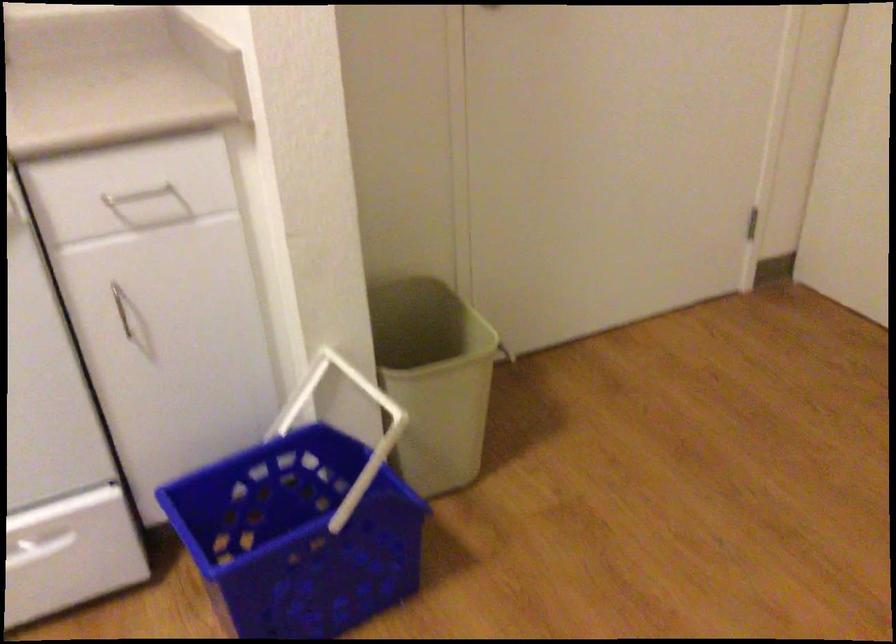
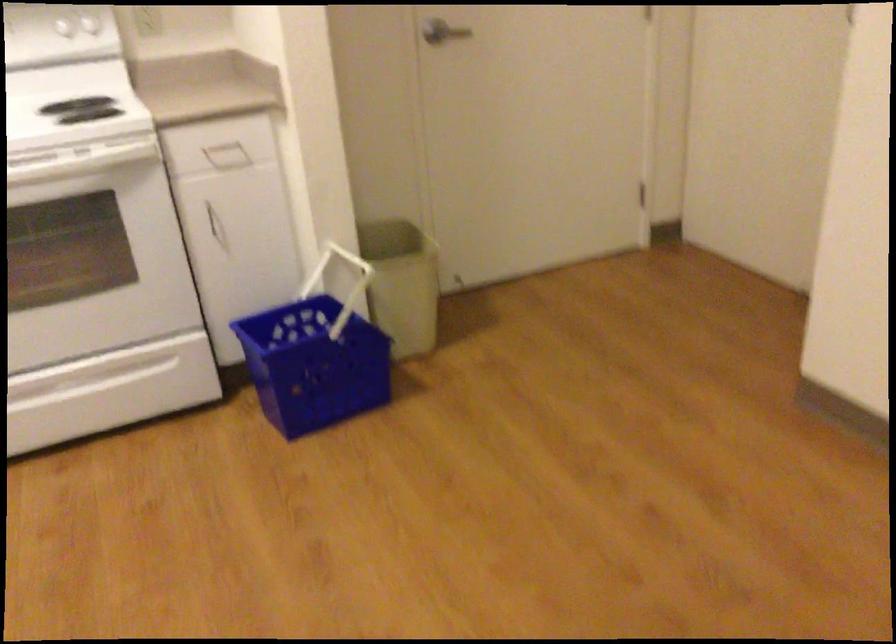
The point at (x=435, y=402) is marked in the first image. Where is the corresponding point in the second image?

(401, 283)